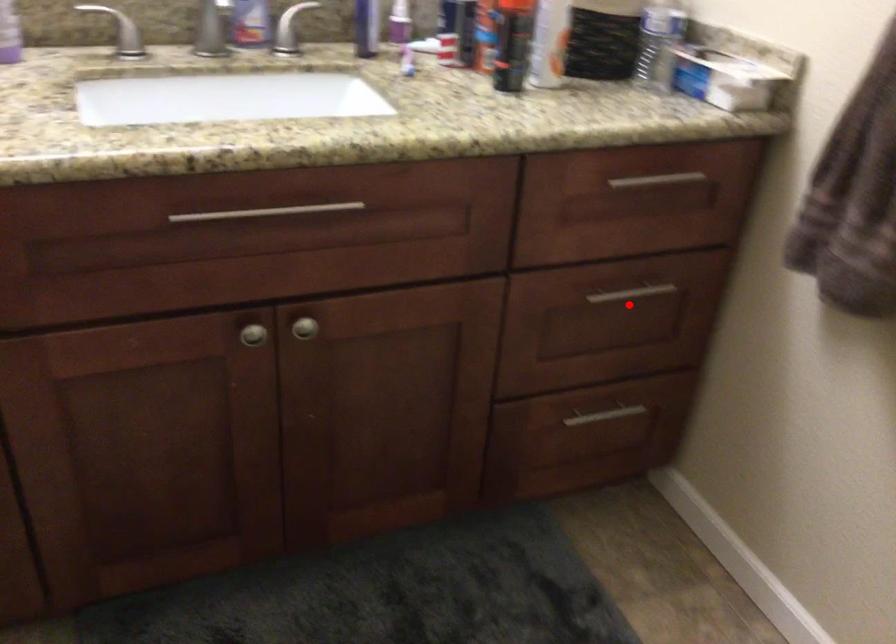
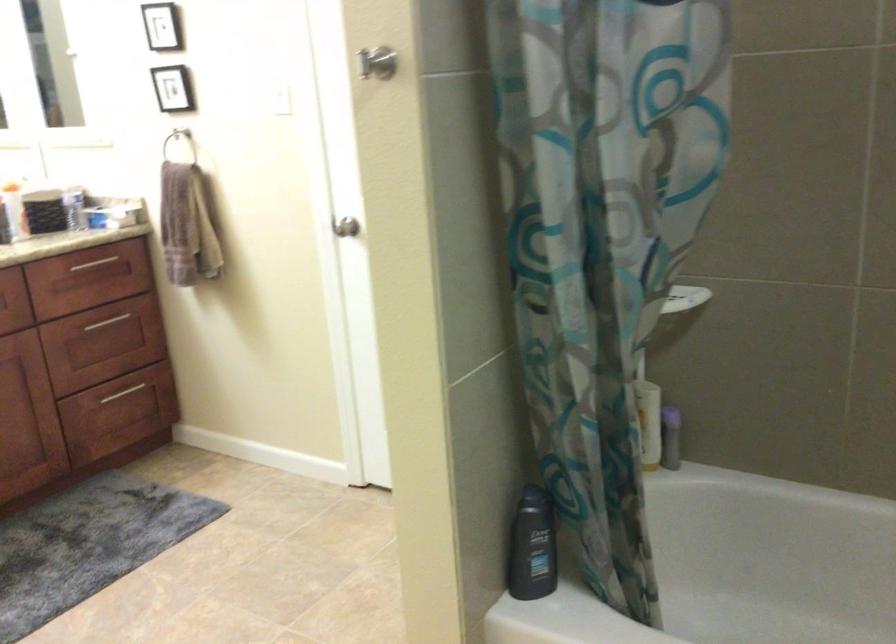
Question: A red point is marked in image1. In image2, is the corresponding 3D point closer to the camera or farther? Reply with the corresponding letter.

Choices:
 (A) The corresponding 3D point is closer.
 (B) The corresponding 3D point is farther.

Answer: (B)